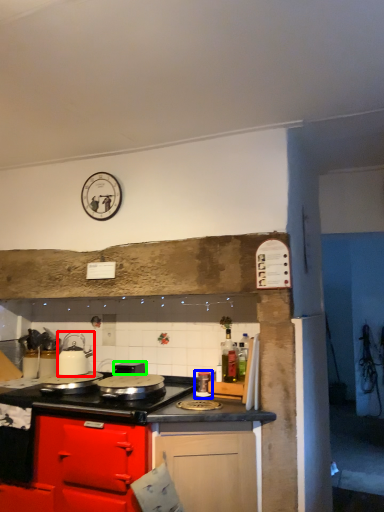
Question: Based on their relative distances, which object is farther from kitchen appliance (highlighted by a red box)? Choose from kitchen appliance (highlighted by a blue box) and appliance (highlighted by a green box).

Choices:
 (A) kitchen appliance
 (B) appliance

Answer: (A)